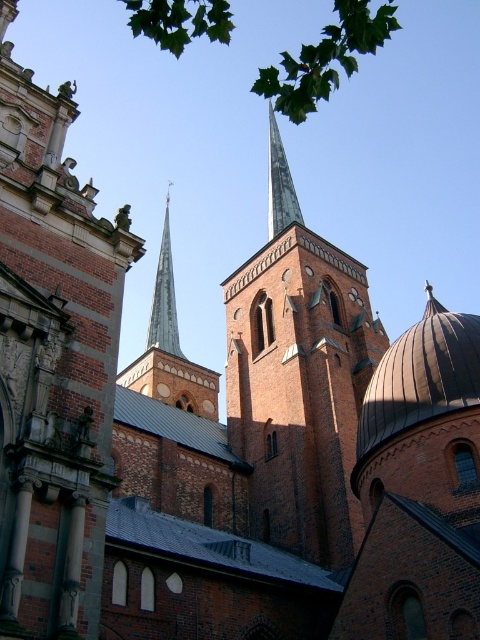
Between brown stone tower at upper center and brown brick tower at center, which one appears on the left side from the viewer's perspective?

From the viewer's perspective, brown stone tower at upper center appears more on the left side.

Image resolution: width=480 pixels, height=640 pixels. Find the location of `brown stone tower at upper center`. brown stone tower at upper center is located at coordinates (52, 364).

What are the coordinates of `brown stone tower at upper center` in the screenshot? It's located at (52, 364).

Is brown brick tower at center shorter than shiny copper spire at upper center?

In fact, brown brick tower at center may be taller than shiny copper spire at upper center.

Is brown brick tower at center to the right of shiny copper spire at upper center from the viewer's perspective?

In fact, brown brick tower at center is to the left of shiny copper spire at upper center.

I want to click on brown brick tower at center, so click(x=299, y=378).

Between green leafy tree at upper center and shiny copper spire at upper center, which one appears on the right side from the viewer's perspective?

shiny copper spire at upper center is more to the right.

Which is above, green leafy tree at upper center or shiny copper spire at upper center?

green leafy tree at upper center

Between point (179, 26) and point (267, 115), which one is positioned behind?

Positioned behind is point (267, 115).

This screenshot has height=640, width=480. I want to click on green leafy tree at upper center, so click(x=325, y=58).